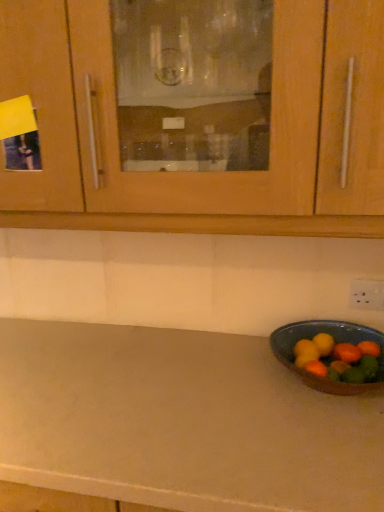
Question: Is wooden cabinet at upper center in front of or behind orange matte/orange at right in the image?

Choices:
 (A) front
 (B) behind

Answer: (A)

Question: Looking at the image, does wooden cabinet at upper center seem bigger or smaller compared to orange matte/orange at right?

Choices:
 (A) small
 (B) big

Answer: (B)

Question: In terms of height, does wooden cabinet at upper center look taller or shorter compared to orange matte/orange at right?

Choices:
 (A) short
 (B) tall

Answer: (B)

Question: Based on their sizes in the image, would you say orange matte/orange at right is bigger or smaller than wooden cabinet at upper center?

Choices:
 (A) small
 (B) big

Answer: (A)

Question: Based on their positions, is orange matte/orange at right located to the left or right of wooden cabinet at upper center?

Choices:
 (A) right
 (B) left

Answer: (A)

Question: Is orange matte/orange at right in front of or behind wooden cabinet at upper center in the image?

Choices:
 (A) behind
 (B) front

Answer: (A)

Question: Does point (354, 353) appear closer or farther from the camera than point (332, 233)?

Choices:
 (A) closer
 (B) farther

Answer: (B)